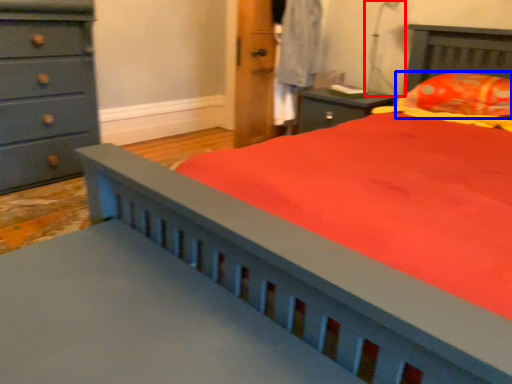
Question: Which object appears farthest to the camera in this image, table lamp (highlighted by a red box) or pillow (highlighted by a blue box)?

Choices:
 (A) table lamp
 (B) pillow

Answer: (A)